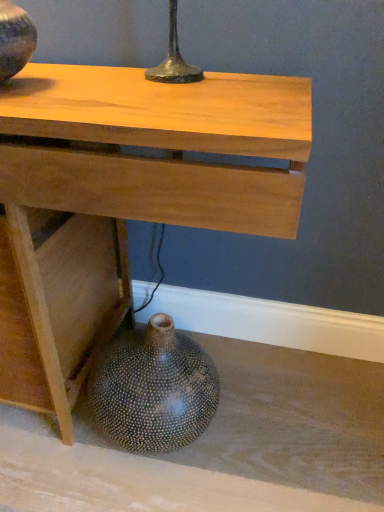
Question: Is natural wood table at center turned away from speckled ceramic vase at lower left, placed as the 1th vase when sorted from back to front?

Choices:
 (A) yes
 (B) no

Answer: (A)

Question: Considering the relative sizes of natural wood table at center and speckled ceramic vase at lower left, the second vase in the left-to-right sequence, in the image provided, is natural wood table at center taller than speckled ceramic vase at lower left, the second vase in the left-to-right sequence,?

Choices:
 (A) no
 (B) yes

Answer: (B)

Question: Is natural wood table at center at the left side of speckled ceramic vase at lower left, the 2th vase viewed from the top?

Choices:
 (A) yes
 (B) no

Answer: (A)

Question: Does natural wood table at center have a lesser height compared to speckled ceramic vase at lower left, the 1th vase when ordered from right to left?

Choices:
 (A) yes
 (B) no

Answer: (B)

Question: Is natural wood table at center located outside speckled ceramic vase at lower left, the 2th vase viewed from the top?

Choices:
 (A) no
 (B) yes

Answer: (B)

Question: Is matte black vase at upper left, the second vase when ordered from bottom to top, inside or outside of speckled ceramic vase at lower left, the 1th vase when ordered from right to left?

Choices:
 (A) inside
 (B) outside

Answer: (B)

Question: From the image's perspective, is matte black vase at upper left, arranged as the first vase when viewed from the left, positioned above or below speckled ceramic vase at lower left, the second vase in the left-to-right sequence?

Choices:
 (A) below
 (B) above

Answer: (B)

Question: Does point (34, 49) appear closer or farther from the camera than point (112, 364)?

Choices:
 (A) farther
 (B) closer

Answer: (A)

Question: Visually, is matte black vase at upper left, which is the 2th vase from right to left, positioned to the left or to the right of speckled ceramic vase at lower left, the second vase positioned from the front?

Choices:
 (A) right
 (B) left

Answer: (B)

Question: Considering the relative positions of natural wood table at center and speckled ceramic vase at lower left, arranged as the first vase when ordered from the bottom, in the image provided, is natural wood table at center to the left or to the right of speckled ceramic vase at lower left, arranged as the first vase when ordered from the bottom,?

Choices:
 (A) left
 (B) right

Answer: (A)

Question: Which is correct: natural wood table at center is inside speckled ceramic vase at lower left, the second vase positioned from the front, or outside of it?

Choices:
 (A) inside
 (B) outside

Answer: (B)

Question: Relative to speckled ceramic vase at lower left, the 2th vase viewed from the top, is natural wood table at center in front or behind?

Choices:
 (A) front
 (B) behind

Answer: (A)

Question: Looking at the image, does natural wood table at center seem bigger or smaller compared to speckled ceramic vase at lower left, placed as the 1th vase when sorted from back to front?

Choices:
 (A) big
 (B) small

Answer: (A)

Question: Is point (201, 400) positioned closer to the camera than point (13, 66)?

Choices:
 (A) closer
 (B) farther

Answer: (B)

Question: Is speckled ceramic vase at lower left, placed as the 1th vase when sorted from back to front, wider or thinner than matte black vase at upper left, placed as the 2th vase when sorted from back to front?

Choices:
 (A) wide
 (B) thin

Answer: (A)